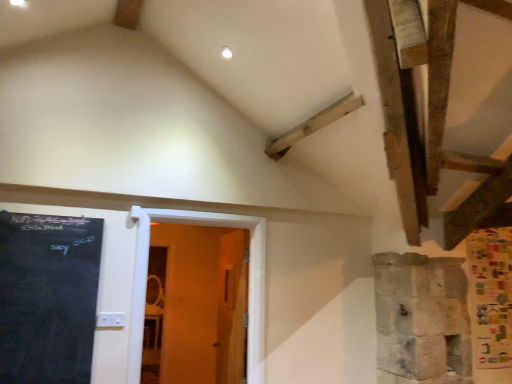
Question: In terms of height, does black chalkboard at left look taller or shorter compared to wooden door at center?

Choices:
 (A) short
 (B) tall

Answer: (A)

Question: Relative to wooden door at center, is black chalkboard at left in front or behind?

Choices:
 (A) front
 (B) behind

Answer: (A)

Question: Is black chalkboard at left to the left or to the right of wooden door at center in the image?

Choices:
 (A) left
 (B) right

Answer: (A)

Question: From a real-world perspective, is wooden door at center above or below black chalkboard at left?

Choices:
 (A) below
 (B) above

Answer: (A)

Question: Would you say wooden door at center is inside or outside black chalkboard at left?

Choices:
 (A) inside
 (B) outside

Answer: (B)

Question: Considering their positions, is wooden door at center located in front of or behind black chalkboard at left?

Choices:
 (A) front
 (B) behind

Answer: (B)

Question: In terms of width, does wooden door at center look wider or thinner when compared to black chalkboard at left?

Choices:
 (A) thin
 (B) wide

Answer: (B)